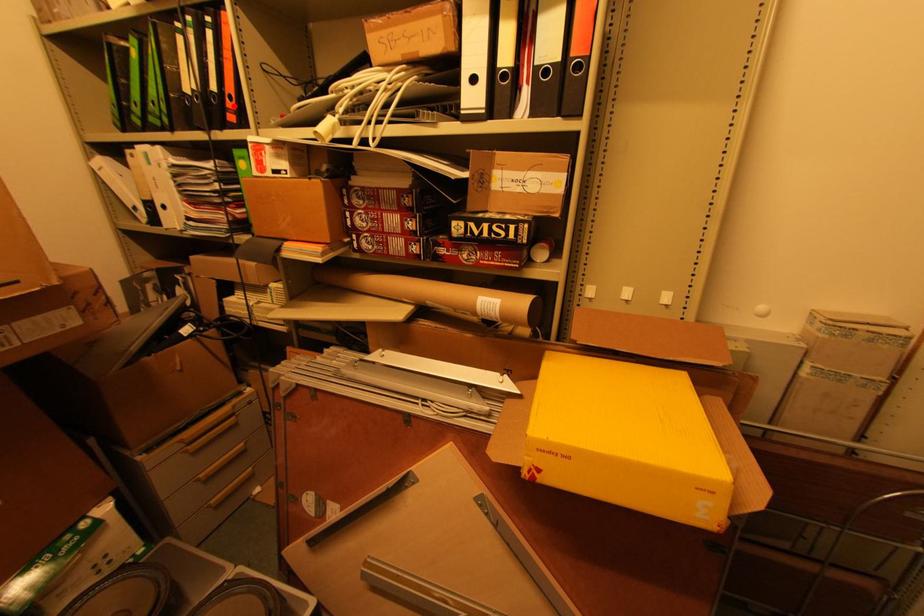
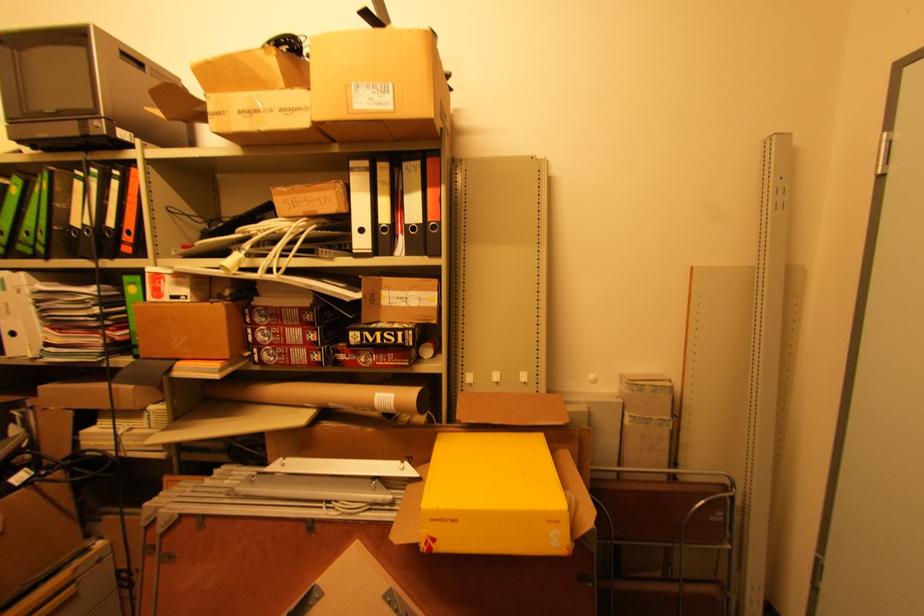
In the second image, find the point that corresponds to the highlighted location in the first image.

(131, 238)